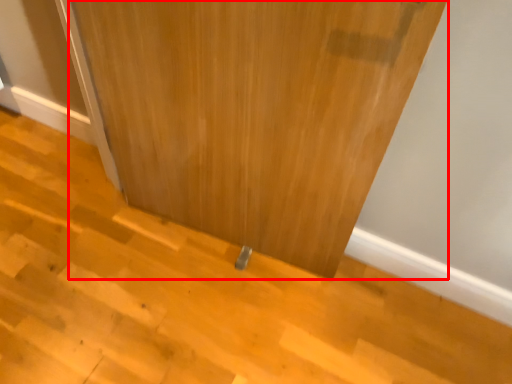
Question: From the image, what is the correct spatial relationship of door (annotated by the red box) in relation to stair?

Choices:
 (A) left
 (B) right

Answer: (A)